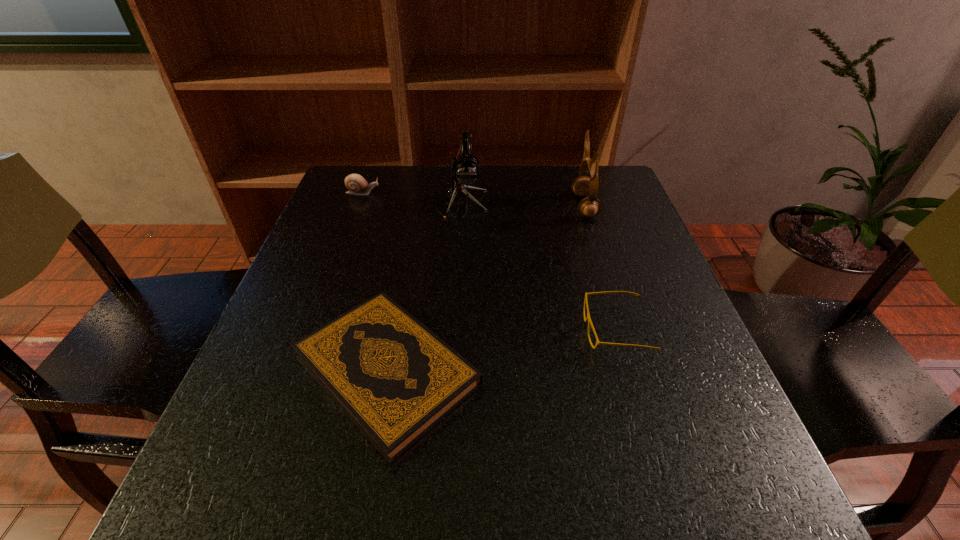
Locate an element on the screen. free region located 0.400m in front of the lenses of the second shortest object is located at coordinates (374, 330).

The image size is (960, 540). What are the coordinates of `free space located in front of the lenses of the second shortest object` in the screenshot? It's located at (474, 330).

At what (x,y) coordinates should I click in order to perform the action: click on free space located 0.200m in front of the lenses of the second shortest object. Please return your answer as a coordinate pair (x, y). This screenshot has width=960, height=540. Looking at the image, I should click on (479, 330).

Locate an element on the screen. The width and height of the screenshot is (960, 540). free spot located 0.130m on the right of the hardback book is located at coordinates (559, 370).

Identify the location of escargot at the far edge. (355, 183).

The width and height of the screenshot is (960, 540). In order to click on escargot situated at the left edge in this screenshot , I will do `click(355, 183)`.

Find the location of `hardback book that is at the left edge`. hardback book that is at the left edge is located at coordinates (395, 379).

Locate an element on the screen. The width and height of the screenshot is (960, 540). earphone present at the right edge is located at coordinates (589, 207).

Identify the location of spectacles located in the right edge section of the desktop. The image size is (960, 540). (588, 318).

I want to click on object present at the far left corner, so point(355,183).